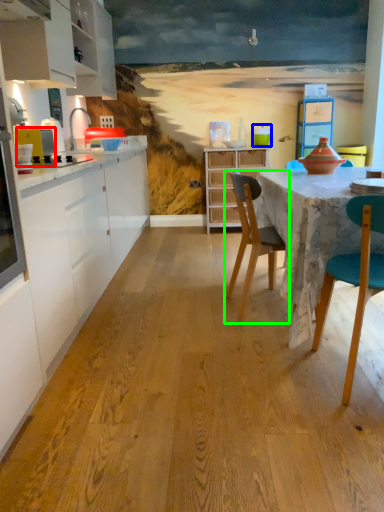
Question: Which object is the farthest from appliance (highlighted by a red box)? Choose among these: teal (highlighted by a blue box) or chair (highlighted by a green box).

Choices:
 (A) teal
 (B) chair

Answer: (A)